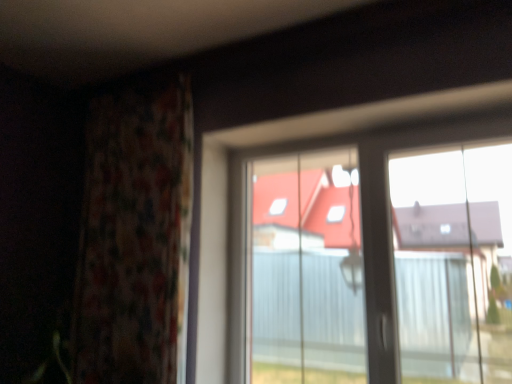
Measure the distance between point (109, 365) and camera.

1.88 meters.

Image resolution: width=512 pixels, height=384 pixels. What do you see at coordinates (134, 235) in the screenshot?
I see `floral fabric curtain at left` at bounding box center [134, 235].

The width and height of the screenshot is (512, 384). Identify the location of floral fabric curtain at left. (134, 235).

At what (x,y) coordinates should I click in order to perform the action: click on transparent plastic window at center. Please return your answer as a coordinate pair (x, y). Looking at the image, I should click on (362, 267).

What do you see at coordinates (362, 267) in the screenshot? I see `transparent plastic window at center` at bounding box center [362, 267].

Identify the location of floral fabric curtain at left. Image resolution: width=512 pixels, height=384 pixels. (134, 235).

Does transparent plastic window at center appear on the right side of floral fabric curtain at left?

Yes, transparent plastic window at center is to the right of floral fabric curtain at left.

Which object is further away from the camera taking this photo, transparent plastic window at center or floral fabric curtain at left?

Positioned behind is floral fabric curtain at left.

Does point (342, 362) lie behind point (167, 106)?

That is True.

From the image's perspective, would you say transparent plastic window at center is positioned over floral fabric curtain at left?

No, from the image's perspective, transparent plastic window at center is not above floral fabric curtain at left.

From a real-world perspective, is transparent plastic window at center positioned over floral fabric curtain at left based on gravity?

Actually, transparent plastic window at center is physically below floral fabric curtain at left in the real world.

Considering the relative sizes of transparent plastic window at center and floral fabric curtain at left in the image provided, is transparent plastic window at center thinner than floral fabric curtain at left?

Yes.

In terms of height, does transparent plastic window at center look taller or shorter compared to floral fabric curtain at left?

Considering their sizes, transparent plastic window at center has less height than floral fabric curtain at left.

Does transparent plastic window at center have a larger size compared to floral fabric curtain at left?

Incorrect, transparent plastic window at center is not larger than floral fabric curtain at left.

Would you say transparent plastic window at center contains floral fabric curtain at left?

No, floral fabric curtain at left is not surrounded by transparent plastic window at center.

Is transparent plastic window at center placed right next to floral fabric curtain at left?

No, transparent plastic window at center is not next to floral fabric curtain at left.

Is transparent plastic window at center facing away from floral fabric curtain at left?

transparent plastic window at center does not have its back to floral fabric curtain at left.

What's the angular difference between transparent plastic window at center and floral fabric curtain at left's facing directions?

There is a 1.26-degree angle between the facing directions of transparent plastic window at center and floral fabric curtain at left.

The height and width of the screenshot is (384, 512). In order to click on curtain above the transparent plastic window at center (from the image's perspective) in this screenshot , I will do `click(134, 235)`.

In the image, is floral fabric curtain at left on the left side or the right side of transparent plastic window at center?

floral fabric curtain at left is positioned on transparent plastic window at center's left side.

Does floral fabric curtain at left come behind transparent plastic window at center?

Yes, floral fabric curtain at left is further from the camera.

Which point is more distant from viewer, (124,138) or (387,382)?

The point (124,138) is behind.

From the image's perspective, does floral fabric curtain at left appear lower than transparent plastic window at center?

Actually, floral fabric curtain at left appears above transparent plastic window at center in the image.

From a real-world perspective, is floral fabric curtain at left physically below transparent plastic window at center?

Incorrect, from a real-world perspective, floral fabric curtain at left is higher than transparent plastic window at center.

In the scene shown: Which object is wider, floral fabric curtain at left or transparent plastic window at center?

floral fabric curtain at left.

Does floral fabric curtain at left have a lesser height compared to transparent plastic window at center?

Incorrect, the height of floral fabric curtain at left does not fall short of that of transparent plastic window at center.

Who is bigger, floral fabric curtain at left or transparent plastic window at center?

floral fabric curtain at left.

Would you say floral fabric curtain at left is inside or outside transparent plastic window at center?

floral fabric curtain at left is spatially situated outside transparent plastic window at center.

Is floral fabric curtain at left in contact with transparent plastic window at center?

floral fabric curtain at left and transparent plastic window at center are not in contact.

Is floral fabric curtain at left facing away from transparent plastic window at center?

That's not correct — floral fabric curtain at left is not looking away from transparent plastic window at center.

Can you tell me how much floral fabric curtain at left and transparent plastic window at center differ in facing direction?

1.26 degrees.

I want to click on curtain on the left of transparent plastic window at center, so click(x=134, y=235).

This screenshot has width=512, height=384. I want to click on window that appears below the floral fabric curtain at left (from the image's perspective), so click(362, 267).

The image size is (512, 384). I want to click on curtain that appears behind the transparent plastic window at center, so click(x=134, y=235).